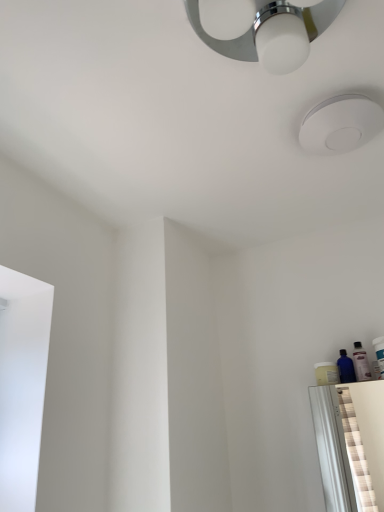
Where is `translucent plastic bottle at right, the 1th toiletry positioned from the left`? Image resolution: width=384 pixels, height=512 pixels. translucent plastic bottle at right, the 1th toiletry positioned from the left is located at coordinates (361, 362).

Describe the element at coordinates (361, 362) in the screenshot. I see `translucent plastic bottle at right, the 1th toiletry positioned from the left` at that location.

Where is `white matte droplight at upper center`? white matte droplight at upper center is located at coordinates (340, 124).

What are the coordinates of `translucent plastic bottle at right, acting as the 2th toiletry starting from the right` in the screenshot? It's located at (361, 362).

Is white matte droplight at upper center facing away from translucent plastic bottle at right, the 1th toiletry positioned from the left?

white matte droplight at upper center is not turned away from translucent plastic bottle at right, the 1th toiletry positioned from the left.

From a real-world perspective, relative to translucent plastic bottle at right, acting as the 2th toiletry starting from the right, is white matte droplight at upper center vertically above or below?

white matte droplight at upper center is situated higher than translucent plastic bottle at right, acting as the 2th toiletry starting from the right, in the real world.

Considering the positions of points (334, 105) and (365, 361), is point (334, 105) farther from camera compared to point (365, 361)?

No, it is in front of (365, 361).

From a real-world perspective, is white plastic toothbrush at right, which is the 1th toiletry in right-to-left order, physically located above or below white matte droplight at upper center?

white plastic toothbrush at right, which is the 1th toiletry in right-to-left order, is below white matte droplight at upper center.

From the image's perspective, is white plastic toothbrush at right, which is the 1th toiletry in right-to-left order, located above white matte droplight at upper center?

Actually, white plastic toothbrush at right, which is the 1th toiletry in right-to-left order, appears below white matte droplight at upper center in the image.

Is white plastic toothbrush at right, which ranks as the second toiletry in left-to-right order, bigger than white matte droplight at upper center?

No.

Is white plastic toothbrush at right, which is the 1th toiletry in right-to-left order, positioned far away from white matte droplight at upper center?

white plastic toothbrush at right, which is the 1th toiletry in right-to-left order, is actually quite close to white matte droplight at upper center.

In terms of width, does transparent plastic bottle at right look wider or thinner when compared to white matte droplight at upper center?

In the image, transparent plastic bottle at right appears to be more narrow than white matte droplight at upper center.

Is transparent plastic bottle at right looking in the opposite direction of white matte droplight at upper center?

No, transparent plastic bottle at right is not facing the opposite direction of white matte droplight at upper center.

Based on their sizes in the image, would you say transparent plastic bottle at right is bigger or smaller than white matte droplight at upper center?

Considering their sizes, transparent plastic bottle at right takes up less space than white matte droplight at upper center.

From the image's perspective, which is above, transparent plastic bottle at right or white matte droplight at upper center?

white matte droplight at upper center.

Can you tell me how much white matte droplight at upper center and transparent plastic bottle at right differ in facing direction?

white matte droplight at upper center and transparent plastic bottle at right are facing 5.29 degrees away from each other.

Is transparent plastic bottle at right at the back of white matte droplight at upper center?

That's not correct — white matte droplight at upper center is not looking away from transparent plastic bottle at right.

From the picture: Considering the relative sizes of white matte droplight at upper center and transparent plastic bottle at right in the image provided, is white matte droplight at upper center smaller than transparent plastic bottle at right?

No, white matte droplight at upper center is not smaller than transparent plastic bottle at right.

Which object is closer to the camera, white matte droplight at upper center or transparent plastic bottle at right?

white matte droplight at upper center is more forward.

Can you tell me how much transparent plastic bottle at right and white plastic toothbrush at right, which is the 1th toiletry in right-to-left order, differ in facing direction?

The angle between the facing direction of transparent plastic bottle at right and the facing direction of white plastic toothbrush at right, which is the 1th toiletry in right-to-left order, is 0.0292 degrees.

From a real-world perspective, which is physically above, transparent plastic bottle at right or white plastic toothbrush at right, which ranks as the second toiletry in left-to-right order?

From a 3D spatial view, transparent plastic bottle at right is above.

Is transparent plastic bottle at right completely or partially outside of white plastic toothbrush at right, which is the 1th toiletry in right-to-left order?

Yes.

Considering the sizes of objects transparent plastic bottle at right and white plastic toothbrush at right, which ranks as the second toiletry in left-to-right order, in the image provided, who is taller, transparent plastic bottle at right or white plastic toothbrush at right, which ranks as the second toiletry in left-to-right order,?

With more height is white plastic toothbrush at right, which ranks as the second toiletry in left-to-right order.

Considering the sizes of objects translucent plastic bottle at right, the 1th toiletry positioned from the left, and white plastic toothbrush at right, which is the 1th toiletry in right-to-left order, in the image provided, who is smaller, translucent plastic bottle at right, the 1th toiletry positioned from the left, or white plastic toothbrush at right, which is the 1th toiletry in right-to-left order,?

translucent plastic bottle at right, the 1th toiletry positioned from the left.

From the image's perspective, between translucent plastic bottle at right, acting as the 2th toiletry starting from the right, and white plastic toothbrush at right, which ranks as the second toiletry in left-to-right order, who is located below?

translucent plastic bottle at right, acting as the 2th toiletry starting from the right.

Is translucent plastic bottle at right, the 1th toiletry positioned from the left, in front of or behind white plastic toothbrush at right, which is the 1th toiletry in right-to-left order, in the image?

translucent plastic bottle at right, the 1th toiletry positioned from the left, is positioned farther from the viewer than white plastic toothbrush at right, which is the 1th toiletry in right-to-left order.

Considering the positions of point (359, 355) and point (380, 344), is point (359, 355) closer or farther from the camera than point (380, 344)?

Point (359, 355) is positioned closer to the camera compared to point (380, 344).

In the scene shown: From a real-world perspective, which is physically below, white matte droplight at upper center or white plastic toothbrush at right, which ranks as the second toiletry in left-to-right order?

In real-world perspective, white plastic toothbrush at right, which ranks as the second toiletry in left-to-right order, is lower.

Can you confirm if white matte droplight at upper center is smaller than white plastic toothbrush at right, which ranks as the second toiletry in left-to-right order?

No, white matte droplight at upper center is not smaller than white plastic toothbrush at right, which ranks as the second toiletry in left-to-right order.

Is white matte droplight at upper center positioned with its back to white plastic toothbrush at right, which is the 1th toiletry in right-to-left order?

No, white matte droplight at upper center is not facing the opposite direction of white plastic toothbrush at right, which is the 1th toiletry in right-to-left order.

Is white matte droplight at upper center with white plastic toothbrush at right, which ranks as the second toiletry in left-to-right order?

No, white matte droplight at upper center is not next to white plastic toothbrush at right, which ranks as the second toiletry in left-to-right order.

Where is `droplight that is on the left side of translucent plastic bottle at right, acting as the 2th toiletry starting from the right`? The height and width of the screenshot is (512, 384). droplight that is on the left side of translucent plastic bottle at right, acting as the 2th toiletry starting from the right is located at coordinates (340, 124).

Find the location of a particular element. Image resolution: width=384 pixels, height=512 pixels. the 2nd toiletry below the white matte droplight at upper center (from a real-world perspective) is located at coordinates (379, 353).

Which object lies further to the anchor point translucent plastic bottle at right, the 1th toiletry positioned from the left, transparent plastic bottle at right or white matte droplight at upper center?

Based on the image, white matte droplight at upper center appears to be further to translucent plastic bottle at right, the 1th toiletry positioned from the left.

When comparing their distances from translucent plastic bottle at right, acting as the 2th toiletry starting from the right, does white plastic toothbrush at right, which ranks as the second toiletry in left-to-right order, or white matte droplight at upper center seem closer?

Among the two, white plastic toothbrush at right, which ranks as the second toiletry in left-to-right order, is located nearer to translucent plastic bottle at right, acting as the 2th toiletry starting from the right.

When comparing their distances from white matte droplight at upper center, does white plastic toothbrush at right, which ranks as the second toiletry in left-to-right order, or translucent plastic bottle at right, the 1th toiletry positioned from the left, seem further?

translucent plastic bottle at right, the 1th toiletry positioned from the left, lies further to white matte droplight at upper center than the other object.

Estimate the real-world distances between objects in this image. Which object is further from white matte droplight at upper center, translucent plastic bottle at right, acting as the 2th toiletry starting from the right, or white plastic toothbrush at right, which is the 1th toiletry in right-to-left order?

translucent plastic bottle at right, acting as the 2th toiletry starting from the right.

Considering their positions, is white plastic toothbrush at right, which ranks as the second toiletry in left-to-right order, positioned further to transparent plastic bottle at right than translucent plastic bottle at right, the 1th toiletry positioned from the left?

white plastic toothbrush at right, which ranks as the second toiletry in left-to-right order, is positioned further to the anchor transparent plastic bottle at right.

Which object lies further to the anchor point white plastic toothbrush at right, which is the 1th toiletry in right-to-left order, white matte droplight at upper center or transparent plastic bottle at right?

white matte droplight at upper center.

Looking at the image, which one is located closer to transparent plastic bottle at right, translucent plastic bottle at right, the 1th toiletry positioned from the left, or white plastic toothbrush at right, which ranks as the second toiletry in left-to-right order?

The object closer to transparent plastic bottle at right is translucent plastic bottle at right, the 1th toiletry positioned from the left.

Based on their spatial positions, is white matte droplight at upper center or transparent plastic bottle at right further from translucent plastic bottle at right, the 1th toiletry positioned from the left?

Among the two, white matte droplight at upper center is located further to translucent plastic bottle at right, the 1th toiletry positioned from the left.

Image resolution: width=384 pixels, height=512 pixels. I want to click on toiletry between white plastic toothbrush at right, which ranks as the second toiletry in left-to-right order, and transparent plastic bottle at right from front to back, so click(361, 362).

I want to click on toiletry between white matte droplight at upper center and translucent plastic bottle at right, acting as the 2th toiletry starting from the right, in the up-down direction, so click(379, 353).